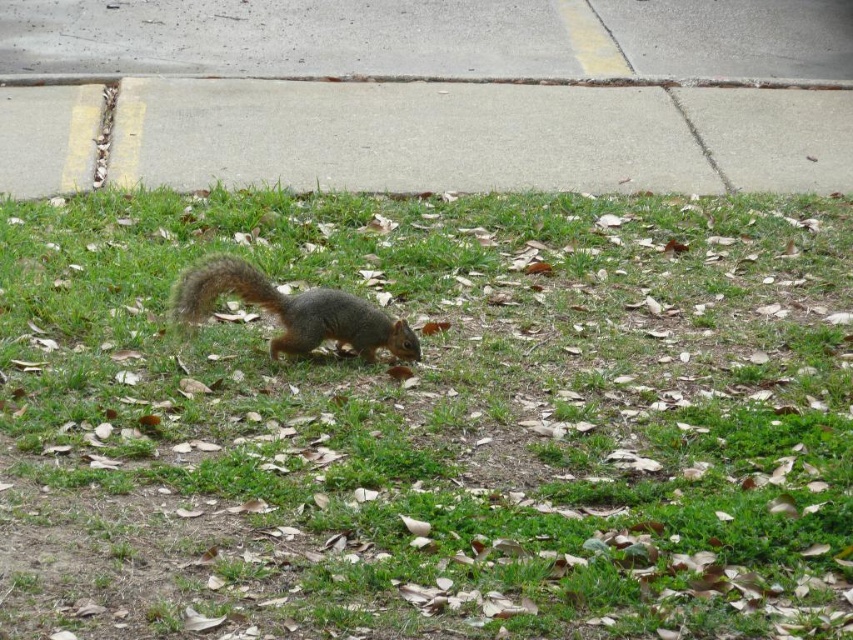
Question: Which is nearer to the gray-furred squirrel at center?

Choices:
 (A) gray asphalt at upper center
 (B) green grass at center

Answer: (B)

Question: Among these objects, which one is nearest to the camera?

Choices:
 (A) fuzzy brown tail at center
 (B) gray concrete pavement at center
 (C) gray concrete curb at upper center

Answer: (A)

Question: Considering the real-world distances, which object is farthest from the gray concrete curb at upper center?

Choices:
 (A) gray asphalt at upper center
 (B) gray concrete pavement at center
 (C) fuzzy brown tail at center

Answer: (C)

Question: Where is gray asphalt at upper center located in relation to gray-furred squirrel at center in the image?

Choices:
 (A) right
 (B) left

Answer: (A)

Question: Does gray concrete pavement at center appear on the right side of gray asphalt at upper center?

Choices:
 (A) yes
 (B) no

Answer: (B)

Question: In this image, where is gray asphalt at upper center located relative to fuzzy brown tail at center?

Choices:
 (A) above
 (B) below

Answer: (A)